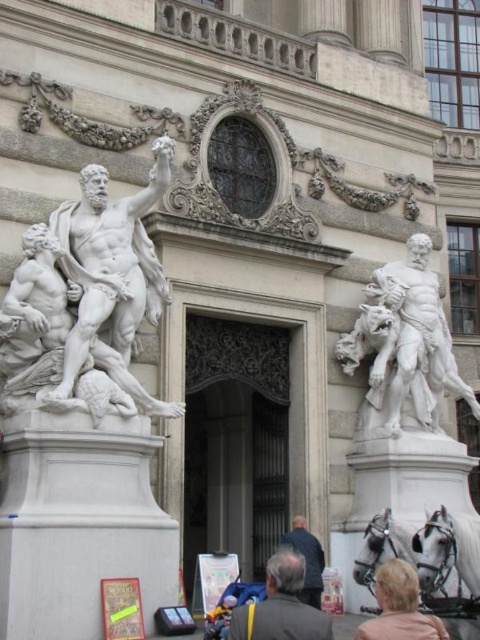
You are standing at the entrance of the grand building and want to take a photo of both the white glossy horse at lower right and the metallic silver coach at center. Can you see both objects in your camera frame at the same time?

The metallic silver coach at center is behind the white glossy horse at lower right, so you cannot see both objects in the same camera frame at the same time.

You are an architect designing a new museum exhibit. You need to place a white marble statue at right and a metallic silver coach at center in a hallway. Given that the hallway is only 3 meters wide, will the statues and coach fit side by side without overlapping?

The white marble statue at right is wider than the metallic silver coach at center. Since the hallway is 3 meters wide, but the combined width of both objects would exceed the available space if the statue is already wider than the coach, they might not fit side by side without overlapping. However, exact dimensions are needed for a precise calculation.

You are standing at the entrance of the grand building and see the white glossy horse at lower right and the metallic silver coach at center. Which object is positioned closer to the ground?

The white glossy horse at lower right is located below the metallic silver coach at center, so it is closer to the ground.